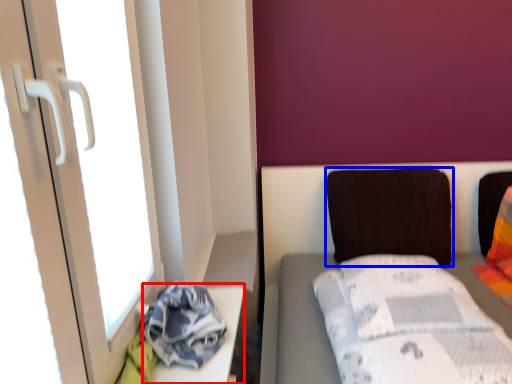
Question: Which point is further to the camera, table (highlighted by a red box) or pillow (highlighted by a blue box)?

Choices:
 (A) table
 (B) pillow

Answer: (B)